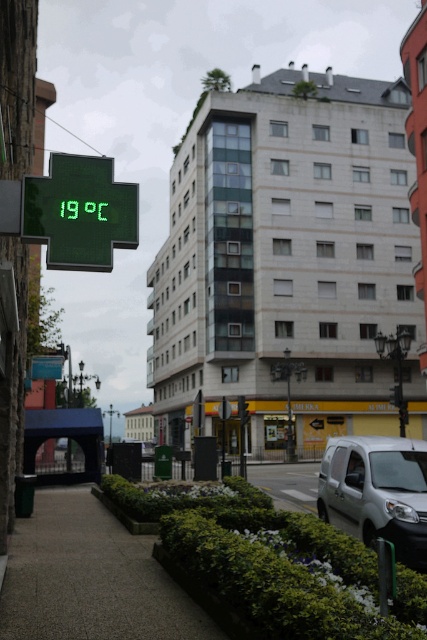
Question: Is green leafy shrubs at lower center smaller than silver metallic van at center?

Choices:
 (A) yes
 (B) no

Answer: (B)

Question: Which of the following is the farthest from the observer?

Choices:
 (A) silver metallic van at center
 (B) green electronic display at upper left
 (C) gray concrete pavement at lower center
 (D) green leafy shrubs at lower center

Answer: (A)

Question: Which object appears closest to the camera in this image?

Choices:
 (A) silver metallic van at center
 (B) green electronic display at upper left
 (C) green leafy shrubs at lower center

Answer: (C)

Question: Among these objects, which one is farthest from the camera?

Choices:
 (A) green electronic display at upper left
 (B) silver metallic van at center

Answer: (B)

Question: Is the position of silver metallic van at center less distant than that of green electronic display at upper left?

Choices:
 (A) no
 (B) yes

Answer: (A)

Question: Does green leafy shrubs at lower center appear on the right side of silver metallic van at center?

Choices:
 (A) no
 (B) yes

Answer: (A)